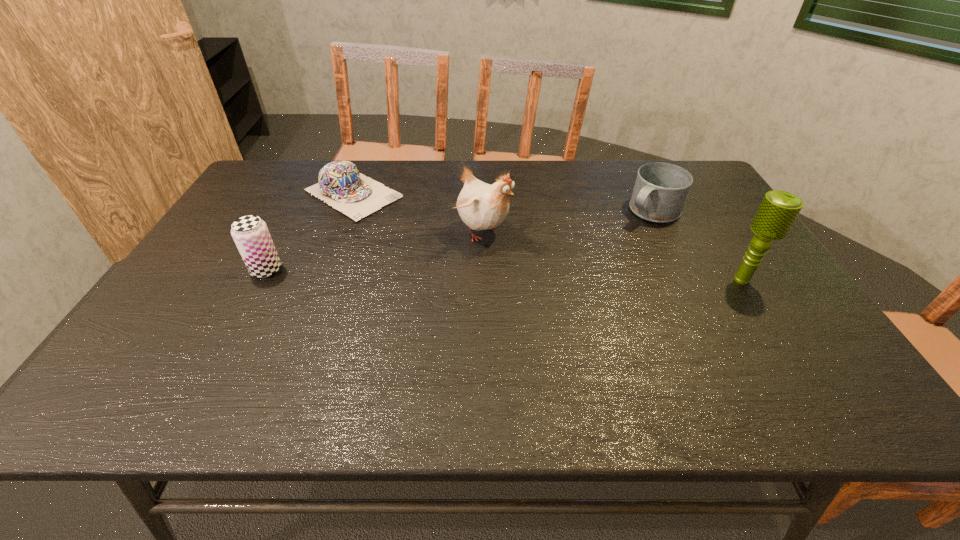
At what (x,y) coordinates should I click in order to perform the action: click on free space located 0.220m on the side of the mug with the handle. Please return your answer as a coordinate pair (x, y). The height and width of the screenshot is (540, 960). Looking at the image, I should click on (594, 259).

Locate an element on the screen. free space located 0.300m on the front, side, and top of the shortest object is located at coordinates (459, 253).

You are a GUI agent. You are given a task and a screenshot of the screen. Output one action in this format:
    pyautogui.click(x=<x>, y=<y>)
    Task: Click on the free space located 0.100m on the front, side, and top of the shortest object
    This screenshot has width=960, height=540.
    Given the screenshot: What is the action you would take?
    pyautogui.click(x=409, y=225)

The image size is (960, 540). What are the coordinates of `vacant region located on the front, side, and top of the shortest object` in the screenshot? It's located at (407, 224).

You are a GUI agent. You are given a task and a screenshot of the screen. Output one action in this format:
    pyautogui.click(x=<x>, y=<y>)
    Task: Click on the vacant point located 0.070m at the beak of the third object from left to right
    
    Given the screenshot: What is the action you would take?
    pyautogui.click(x=524, y=256)

You are a GUI agent. You are given a task and a screenshot of the screen. Output one action in this format:
    pyautogui.click(x=<x>, y=<y>)
    Task: Click on the free space located 0.280m at the beak of the third object from left to right
    
    Given the screenshot: What is the action you would take?
    pyautogui.click(x=592, y=292)

Image resolution: width=960 pixels, height=540 pixels. Find the location of `vacant area situated 0.380m at the beak of the third object from left to right`. vacant area situated 0.380m at the beak of the third object from left to right is located at coordinates (630, 312).

At what (x,y) coordinates should I click in order to perform the action: click on mug situated at the far edge. Please return your answer as a coordinate pair (x, y). The image size is (960, 540). Looking at the image, I should click on (660, 191).

Where is `cap that is positioned at the far edge`? The image size is (960, 540). cap that is positioned at the far edge is located at coordinates (341, 185).

You are a GUI agent. You are given a task and a screenshot of the screen. Output one action in this format:
    pyautogui.click(x=<x>, y=<y>)
    Task: Click on the microphone positioned at the right edge
    
    Given the screenshot: What is the action you would take?
    pyautogui.click(x=779, y=209)